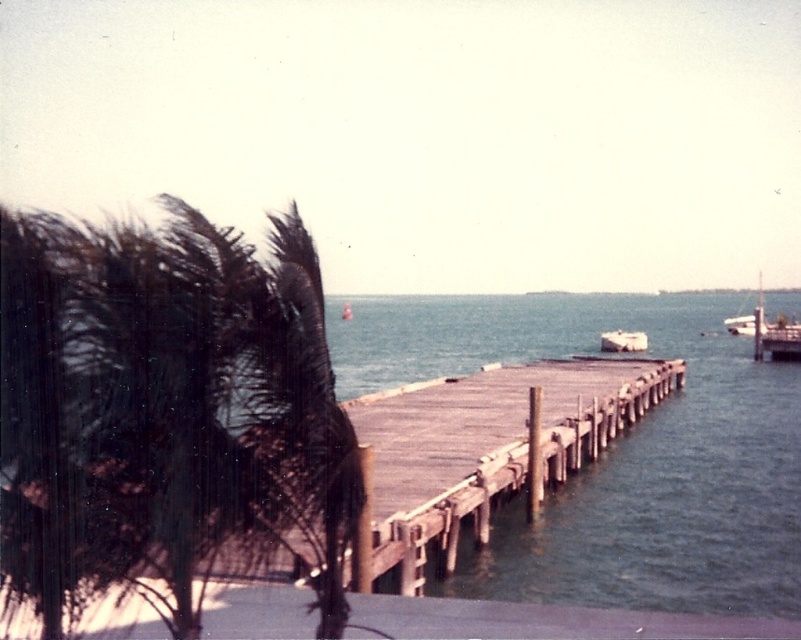
Question: Is wooden dock at center to the left of white matte boat at center from the viewer's perspective?

Choices:
 (A) no
 (B) yes

Answer: (B)

Question: Among these points, which one is farthest from the camera?

Choices:
 (A) (549, 483)
 (B) (747, 323)

Answer: (B)

Question: Can you confirm if dark green fronds at left is bigger than white glossy boat at right?

Choices:
 (A) no
 (B) yes

Answer: (A)

Question: Is dark green fronds at left closer to the viewer compared to white matte boat at center?

Choices:
 (A) yes
 (B) no

Answer: (A)

Question: Based on their relative distances, which object is nearer to the dark green fronds at left?

Choices:
 (A) wooden dock at center
 (B) white glossy boat at right

Answer: (A)

Question: Which object is farther from the camera taking this photo?

Choices:
 (A) dark green fronds at left
 (B) white matte boat at center
 (C) wooden dock at center

Answer: (B)